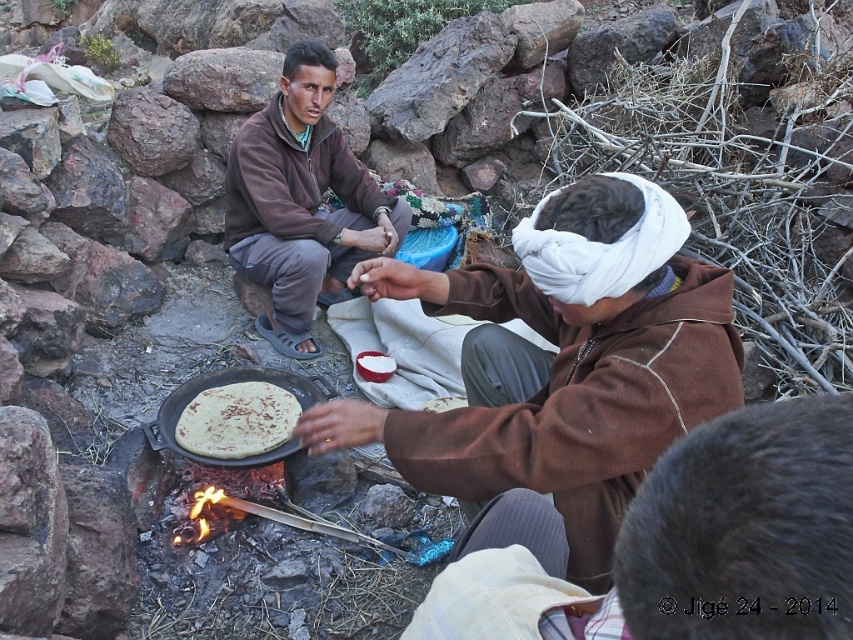
You are a chef preparing to cook a meal. You have a brown soft cloth at center and a brown matte flatbread at center. Which item is closer to you when you are facing the cooking area?

The brown soft cloth at center is closer to you because it is in front of the brown matte flatbread at center.

What is the 2D coordinate of the brown soft cloth at center?

The brown soft cloth at center is located at the 2D coordinate point of [561,362].

You are a chef preparing to add seasoning to the brown matte flatbread at center. The red bowl with seasoning is currently resting on the brown fleece jacket at center. Can you reach the red bowl with seasoning without moving from your current position?

Answer: The distance between the brown fleece jacket at center and the brown matte flatbread at center is 32.84 inches. Since the red bowl is on the jacket, you can easily reach it while staying in place.